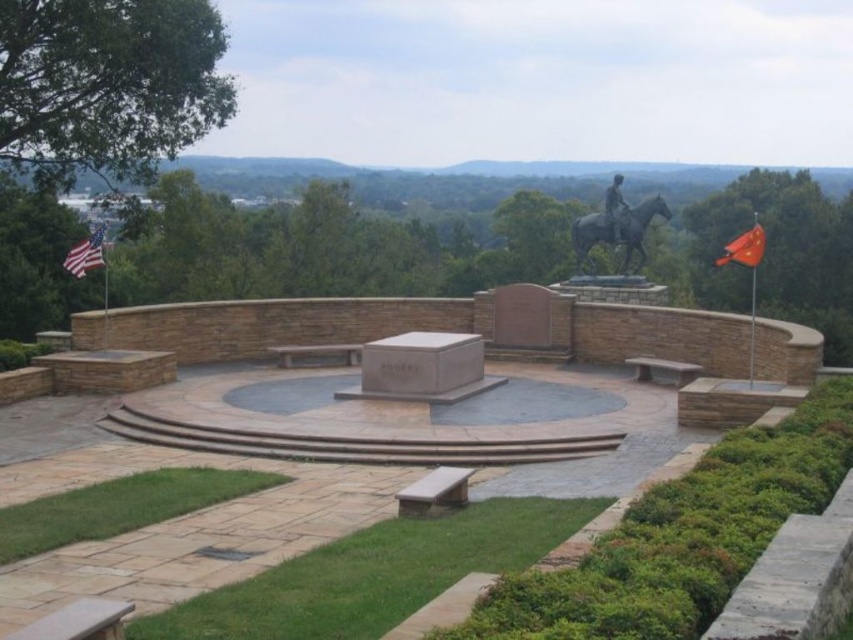
You are a visitor at the memorial site and want to place a wreath between the red fabric flag at right and the american flag at left. Based on their positions, which flag should the wreath be placed closer to?

The wreath should be placed closer to the red fabric flag at right because it is positioned under the american flag at left, indicating it is lower in height.

Based on the photo, you are a visitor at the memorial site. You notice two flags, the red fabric flag at right and the american flag at left. From your vantage point, which flag appears closer to you?

The red fabric flag at right is in front of the american flag at left, so it appears closer to you.

You are standing at the entrance of the memorial site and see two points marked as point 1 and point 2. Point 1 is at coordinates point (86, 264) and point 2 is at coordinates point (624, 200). If you want to visit both points, which point should you visit first to follow the correct path that goes from front to back?

You should visit point (86, 264) first because it is in front of point (624, 200), so following the path from front to back, you start with the point in front.